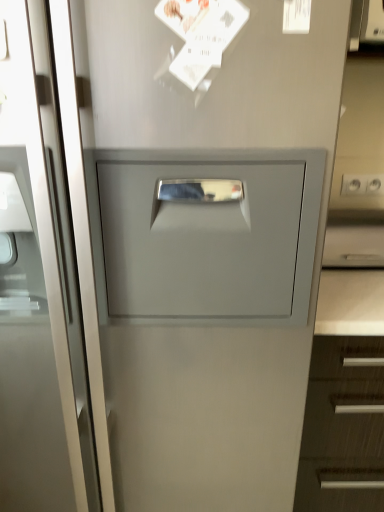
This screenshot has width=384, height=512. What do you see at coordinates (354, 184) in the screenshot?
I see `white plastic electric outlet at right` at bounding box center [354, 184].

Measure the distance between point (354, 189) and camera.

The depth of point (354, 189) is 4.99 feet.

Measure the distance between white plastic electric outlet at right and camera.

The distance of white plastic electric outlet at right from camera is 1.48 meters.

Locate an element on the screen. white plastic electric outlet at right is located at coordinates (354, 184).

Where is `white plastic electric outlet at right`? This screenshot has width=384, height=512. white plastic electric outlet at right is located at coordinates (354, 184).